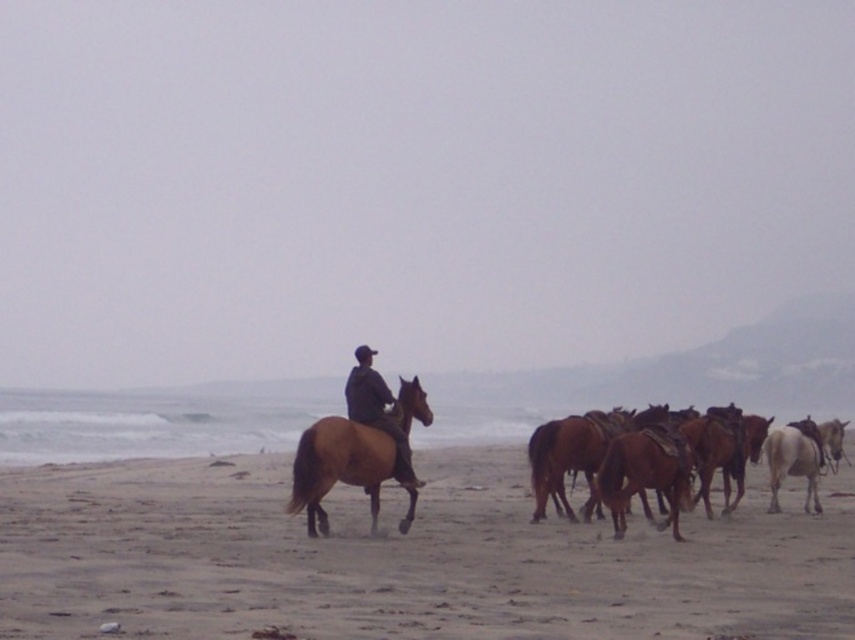
Does brown glossy horse at center have a greater width compared to brown leather horse at lower right?

No.

Does brown glossy horse at center appear on the left side of brown leather horse at lower right?

Yes, brown glossy horse at center is to the left of brown leather horse at lower right.

Identify the location of brown glossy horse at center. 343,468.

Is point (552, 445) closer to viewer compared to point (376, 419)?

No, (552, 445) is behind (376, 419).

Does brown leather horse at lower right appear on the right side of brown leather jacket at center?

Indeed, brown leather horse at lower right is positioned on the right side of brown leather jacket at center.

The width and height of the screenshot is (855, 640). Find the location of `brown leather horse at lower right`. brown leather horse at lower right is located at coordinates (578, 451).

Is brown glossy horse at center above brown leather jacket at center?

No, brown glossy horse at center is not above brown leather jacket at center.

Can you confirm if brown glossy horse at center is thinner than brown leather jacket at center?

In fact, brown glossy horse at center might be wider than brown leather jacket at center.

Where is `brown glossy horse at center`? brown glossy horse at center is located at coordinates tap(343, 468).